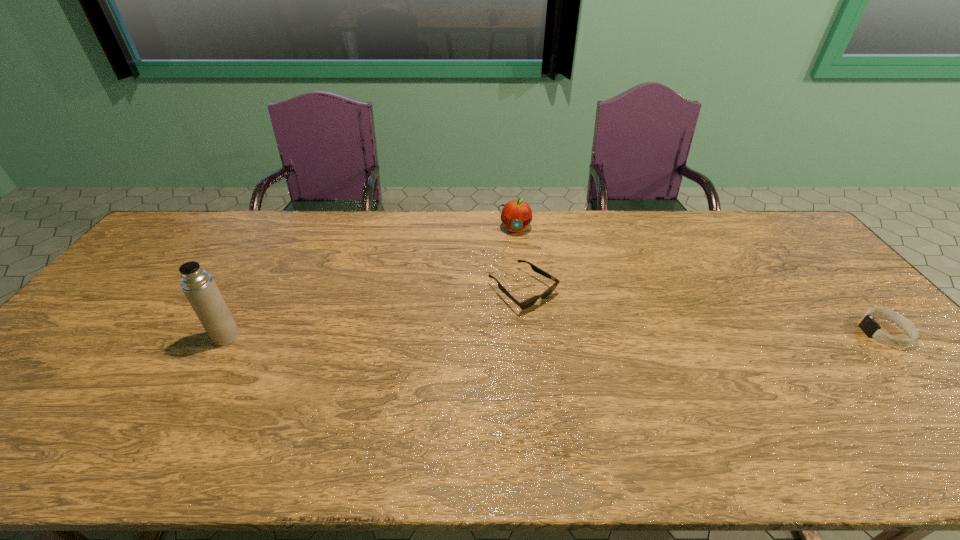
In order to click on the leftmost object in this screenshot , I will do `click(199, 287)`.

Locate an element on the screen. This screenshot has height=540, width=960. thermos bottle is located at coordinates (199, 287).

Locate an element on the screen. the rightmost object is located at coordinates (868, 325).

Where is `the second tallest object`? This screenshot has width=960, height=540. the second tallest object is located at coordinates (516, 214).

Locate an element on the screen. the farthest object is located at coordinates (516, 214).

Where is `sunglasses`? sunglasses is located at coordinates (527, 303).

At what (x,y) coordinates should I click in order to perform the action: click on free space located on the back of the tallest object. Please return your answer as a coordinate pair (x, y). Looking at the image, I should click on (253, 289).

Identify the location of free space located on the outer surface of the rightmost object. (748, 332).

Where is `vacant space located on the outer surface of the rightmost object`? The width and height of the screenshot is (960, 540). vacant space located on the outer surface of the rightmost object is located at coordinates (819, 332).

Find the location of `vacant space located 0.370m on the outer surface of the rightmost object`. vacant space located 0.370m on the outer surface of the rightmost object is located at coordinates (725, 332).